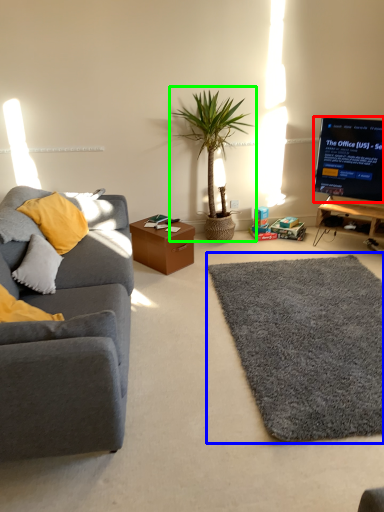
Question: Which object is positioned closest to television (highlighted by a red box)? Select from mat (highlighted by a blue box) and houseplant (highlighted by a green box).

Choices:
 (A) mat
 (B) houseplant

Answer: (B)